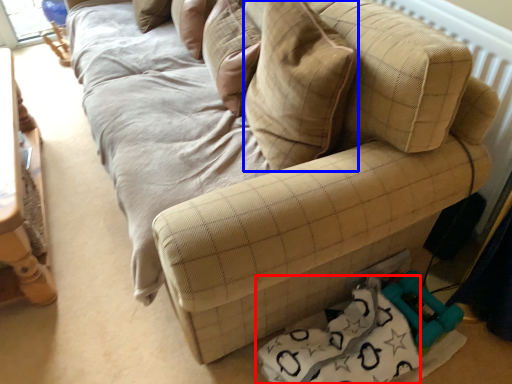
Question: Which of the following is the closest to the observer, material (highlighted by a red box) or throw pillow (highlighted by a blue box)?

Choices:
 (A) material
 (B) throw pillow

Answer: (B)